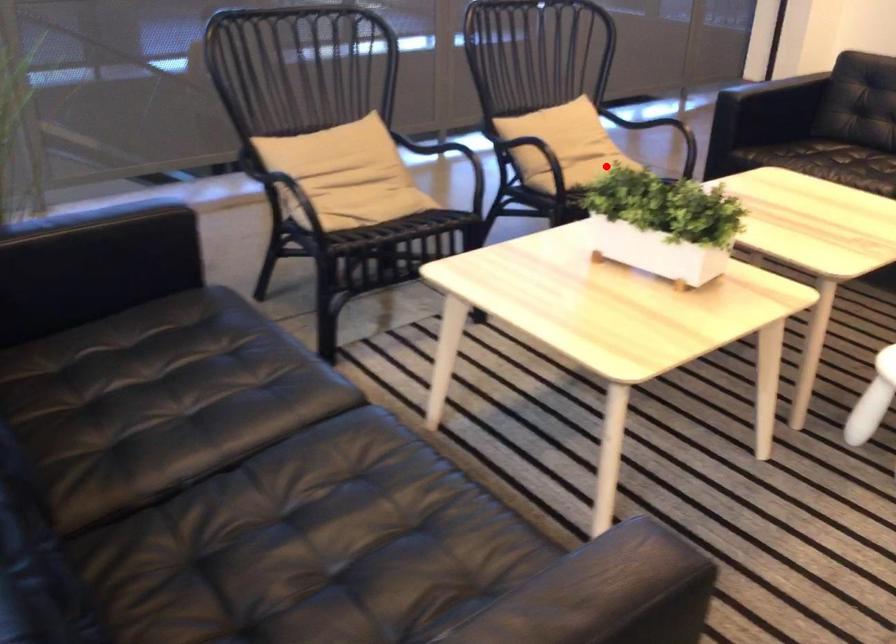
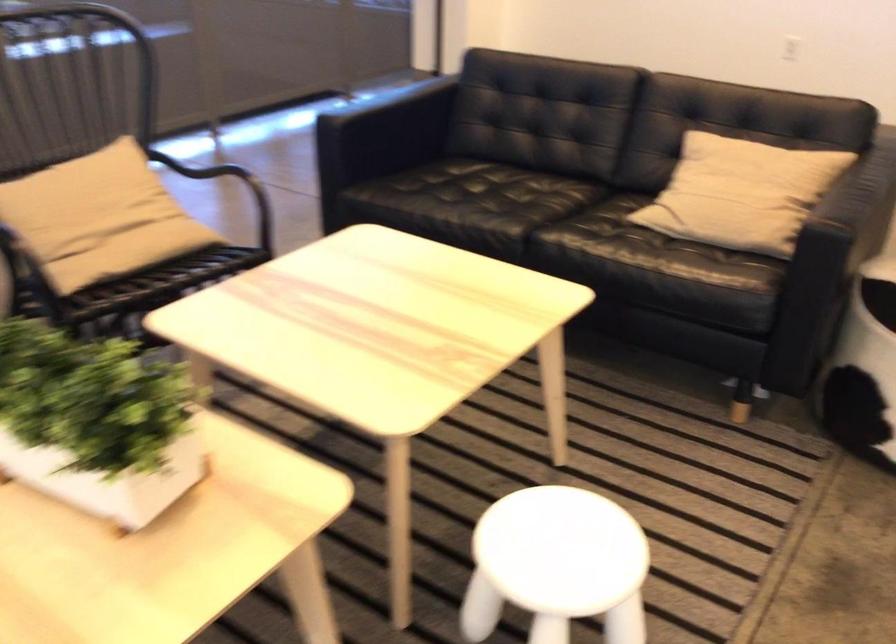
In the second image, find the point that corresponds to the highlighted location in the first image.

(151, 254)